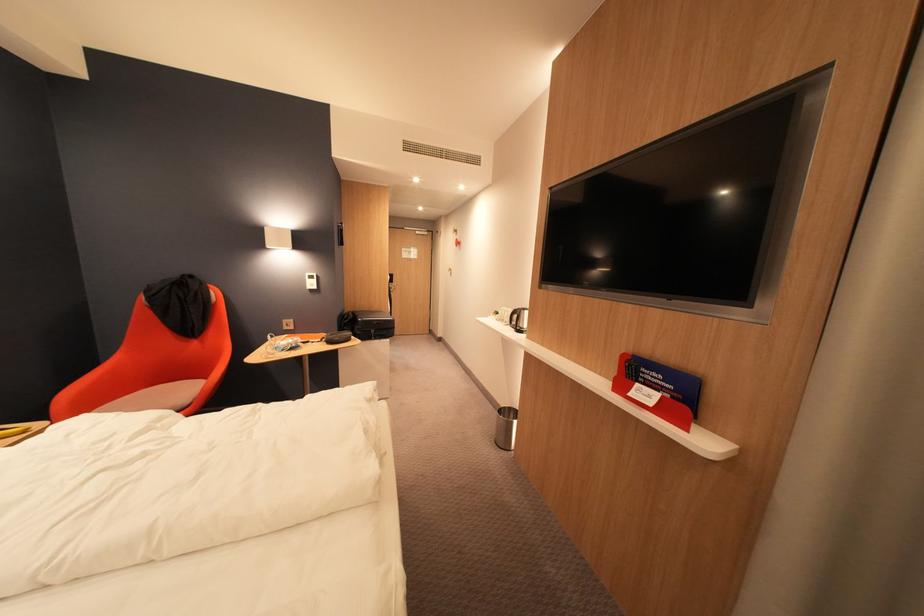
This screenshot has height=616, width=924. Describe the element at coordinates (156, 397) in the screenshot. I see `a red chair sitting surface` at that location.